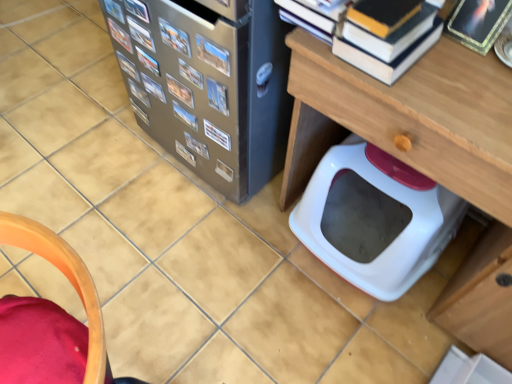
Locate an element on the screen. The image size is (512, 384). vacant space to the left of metallic black file cabinet at center is located at coordinates 87,135.